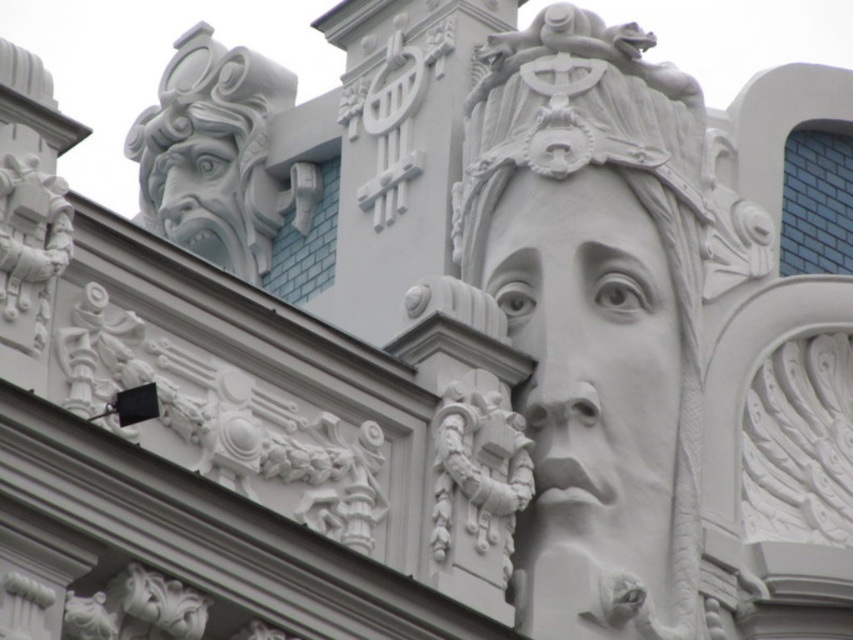
Question: Is white stone face at center below white stone gargoyle at upper left?

Choices:
 (A) no
 (B) yes

Answer: (B)

Question: Does white stone sculpture at upper center appear on the left side of white stone face at center?

Choices:
 (A) yes
 (B) no

Answer: (B)

Question: Which of these objects is positioned closest to the white stone sculpture at upper center?

Choices:
 (A) white stone gargoyle at upper left
 (B) white stone face at center

Answer: (B)

Question: Which point appears closest to the camera in this image?

Choices:
 (A) (614, 406)
 (B) (175, 150)
 (C) (654, 163)

Answer: (A)

Question: Among these objects, which one is nearest to the camera?

Choices:
 (A) white stone face at center
 (B) white stone sculpture at upper center

Answer: (B)

Question: Can you confirm if white stone face at center is positioned below white stone gargoyle at upper left?

Choices:
 (A) no
 (B) yes

Answer: (B)